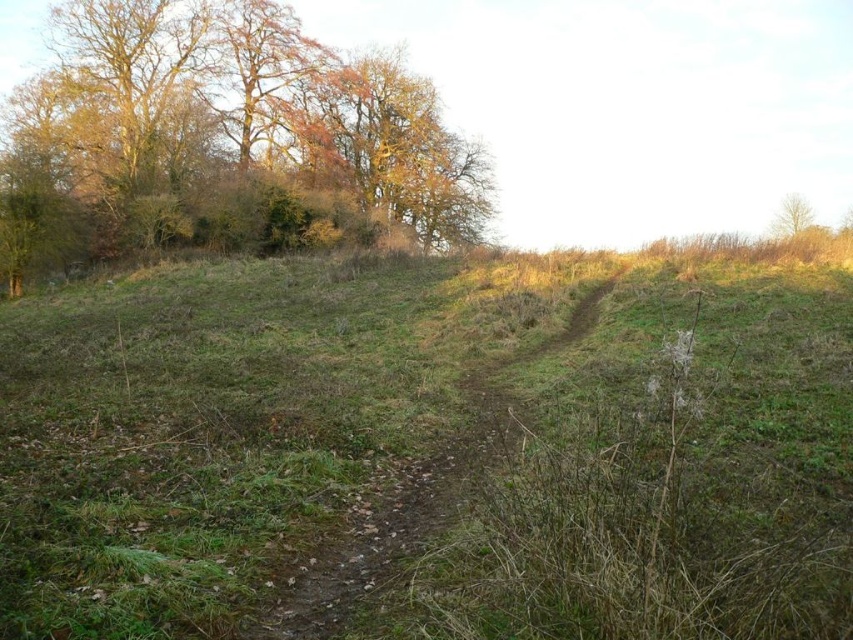
You are a hiker carrying a backpack and need to cross the field. The green grassy at center and dirt path at center are both visible. Which path should you choose to ensure you stay on the most traveled route?

The dirt path at center is the most traveled route, so you should choose the dirt path at center.